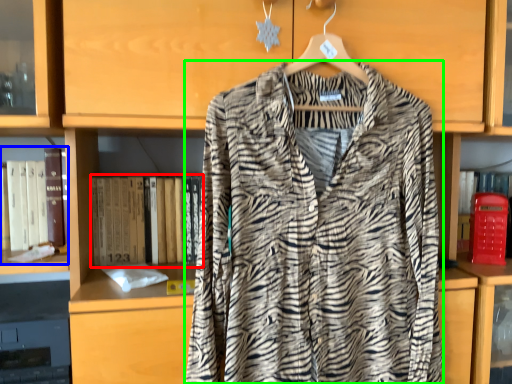
Question: Which is farther away from book (highlighted by a red box)? book (highlighted by a blue box) or fancy dress (highlighted by a green box)?

Choices:
 (A) book
 (B) fancy dress

Answer: (B)